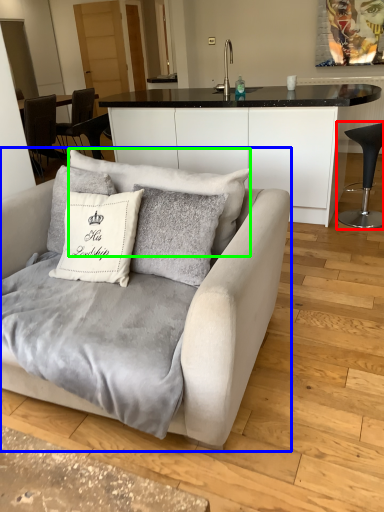
Question: Estimate the real-world distances between objects in this image. Which object is farther from chair (highlighted by a red box), studio couch (highlighted by a blue box) or pillow (highlighted by a green box)?

Choices:
 (A) studio couch
 (B) pillow

Answer: (A)